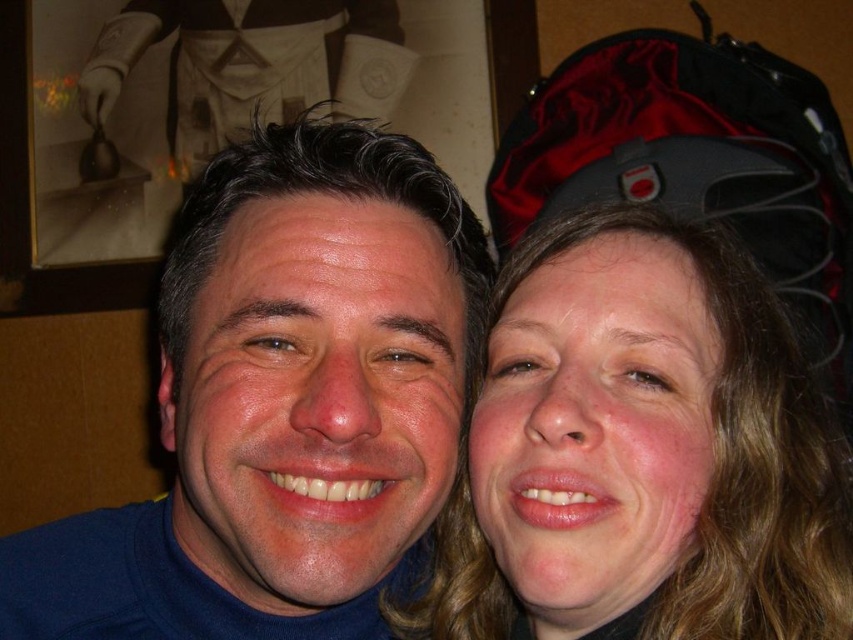
You are holding a 12 inch ruler and want to measure the distance between yourself and the point at coordinates point (316, 452) in the image. Can you reach it with the ruler?

The distance between you and the point (316, 452) is 18.45 inches, so yes, the ruler can reach it since it is shorter than the ruler length.

You are a photographer adjusting the lighting for a photo shoot. You notice the blue turtleneck sweater at center and the white cloth at upper center. Which object is closer to the camera?

The blue turtleneck sweater at center is closer to the camera because it is in front of the white cloth at upper center.

You are a photographer trying to adjust the lighting for a photo shoot. You notice the smooth skin face at right and the white cloth at upper center. Which object is located to the right of the other?

The smooth skin face at right is positioned on the right side of white cloth at upper center, so the smooth skin face at right is to the right of the white cloth at upper center.